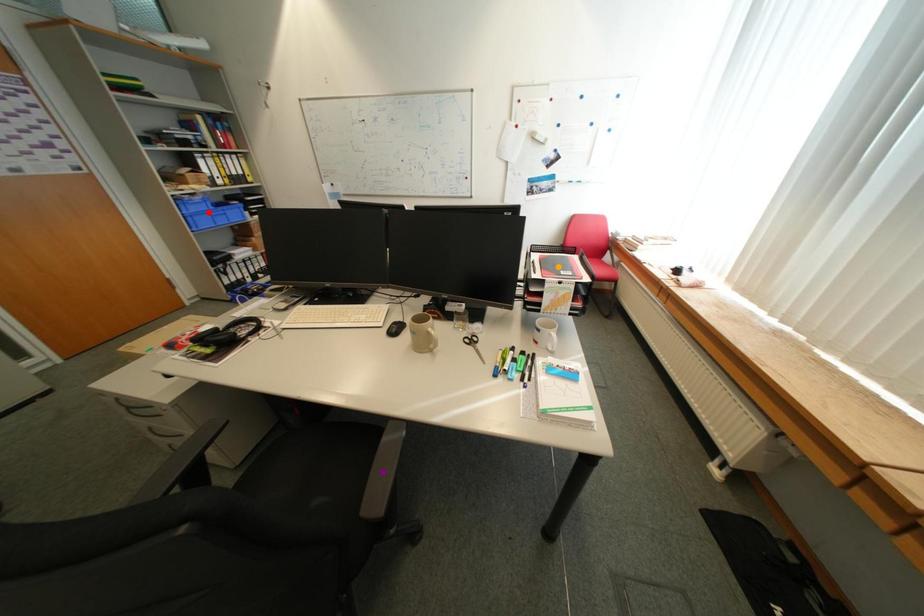
Order these from nearest to farthest:
1. red point
2. orange point
3. purple point

1. purple point
2. orange point
3. red point